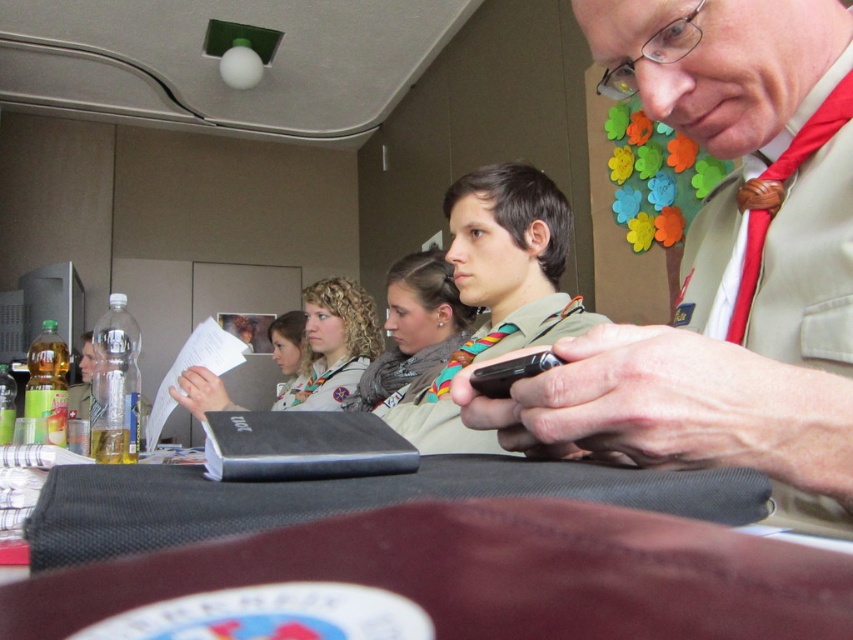
Does point (596, 436) lie in front of point (369, 564)?

No, it is behind (369, 564).

Who is more forward, (648, 61) or (496, 616)?

Point (496, 616) is in front.

Find the location of `khaki uniform at upper right`. khaki uniform at upper right is located at coordinates (724, 260).

The width and height of the screenshot is (853, 640). I want to click on khaki uniform at upper right, so click(724, 260).

Locate an element on the screen. khaki uniform at upper right is located at coordinates (724, 260).

Does point (805, 422) come behind point (335, 316)?

No, it is in front of (335, 316).

Which is above, khaki uniform at upper right or white fabric scarf at center?

khaki uniform at upper right is above.

Is point (828, 211) in front of point (320, 356)?

Yes, it is in front of point (320, 356).

Where is `khaki uniform at upper right`? The width and height of the screenshot is (853, 640). khaki uniform at upper right is located at coordinates (724, 260).